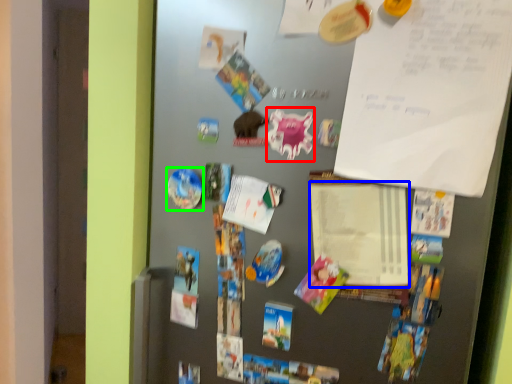
Question: Which is farther away from art (highlighted by a red box)? notepad (highlighted by a blue box) or art (highlighted by a green box)?

Choices:
 (A) notepad
 (B) art

Answer: (B)